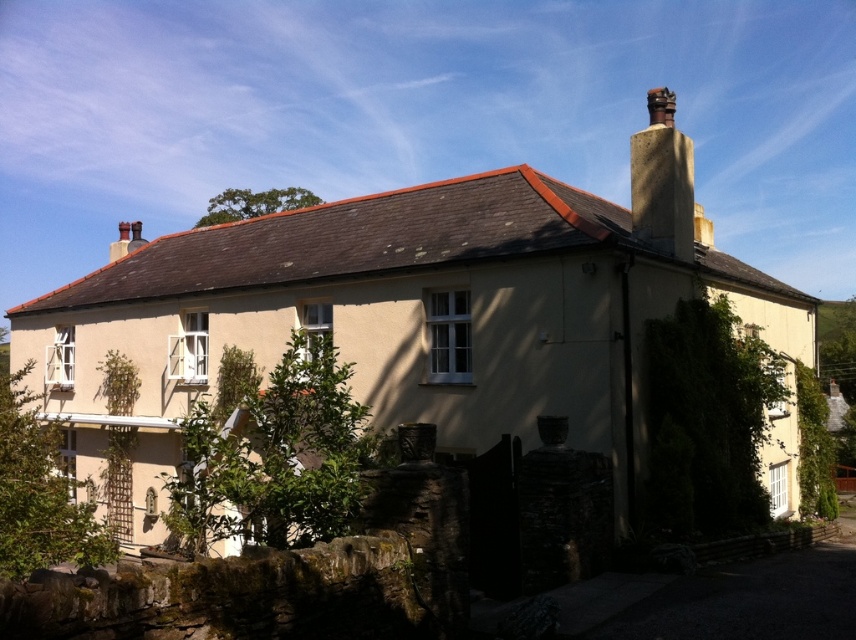
Between beige stucco cottage at center and smooth stone chimney at upper right, which one is positioned lower?

beige stucco cottage at center

In the scene shown: Is beige stucco cottage at center thinner than smooth stone chimney at upper right?

No, beige stucco cottage at center is not thinner than smooth stone chimney at upper right.

Who is more distant from viewer, (531, 310) or (669, 141)?

Point (669, 141)

I want to click on beige stucco cottage at center, so click(x=396, y=320).